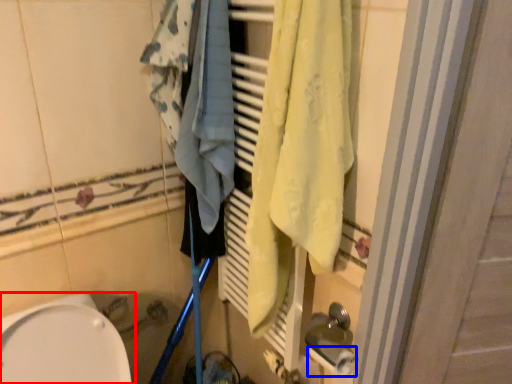
Question: Which object appears farthest to the camera in this image, toilet (highlighted by a red box) or toilet paper (highlighted by a blue box)?

Choices:
 (A) toilet
 (B) toilet paper

Answer: (B)